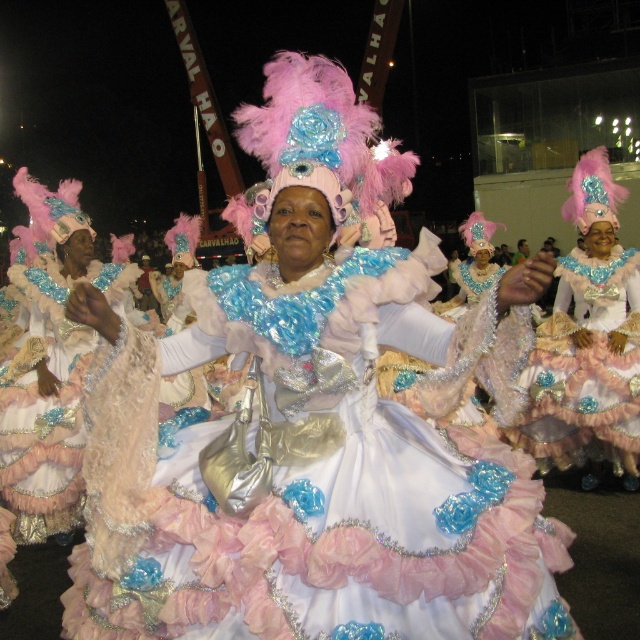
You are a photographer at the parade and want to capture both the shiny sequined dress at center and the frosted lace dress at center in a single wide shot. Given that your camera has a maximum focus range of 4 meters, will you be able to focus on both dresses simultaneously?

The distance between the shiny sequined dress at center and the frosted lace dress at center is 4.19 meters. Since your camera can only focus up to 4 meters, the dresses are slightly too far apart for both to be in focus at the same time.

You are a photographer at the parade and want to capture the shiny sequined dress at center and the frosted lace dress at center in a single shot. Which dress should you focus on first to ensure both are in frame?

The shiny sequined dress at center is located above the frosted lace dress at center, so you should focus on the frosted lace dress at center first to ensure both are in frame.